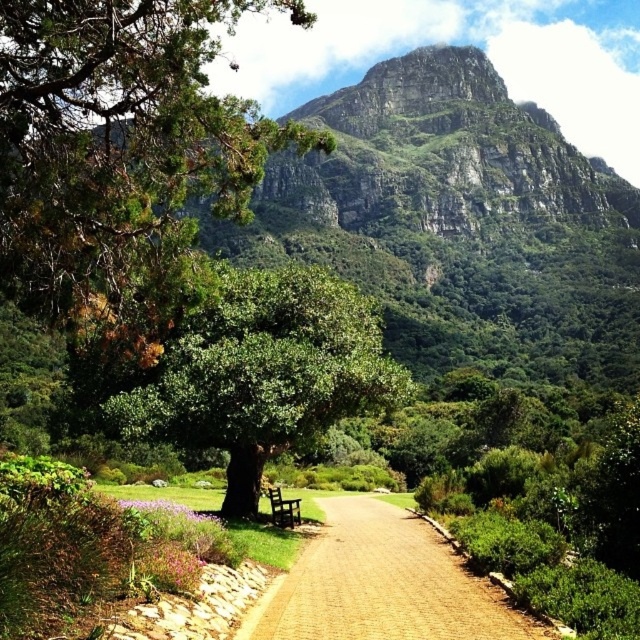
Question: Which is nearer to the dark brown wooden bench at center?

Choices:
 (A) brown cobblestone path at center
 (B) green leafy tree at center

Answer: (B)

Question: Based on their relative distances, which object is farther from the green leafy tree at center?

Choices:
 (A) dark brown wooden bench at center
 (B) green needle-like at upper left
 (C) brown cobblestone path at center

Answer: (C)

Question: Which object is the farthest from the green needle-like at upper left?

Choices:
 (A) brown cobblestone path at center
 (B) dark brown wooden bench at center

Answer: (B)

Question: Is green needle-like at upper left further to camera compared to dark brown wooden bench at center?

Choices:
 (A) yes
 (B) no

Answer: (B)

Question: Does green leafy tree at center have a greater width compared to brown cobblestone path at center?

Choices:
 (A) no
 (B) yes

Answer: (B)

Question: Is green needle-like at upper left to the left of dark brown wooden bench at center from the viewer's perspective?

Choices:
 (A) no
 (B) yes

Answer: (B)